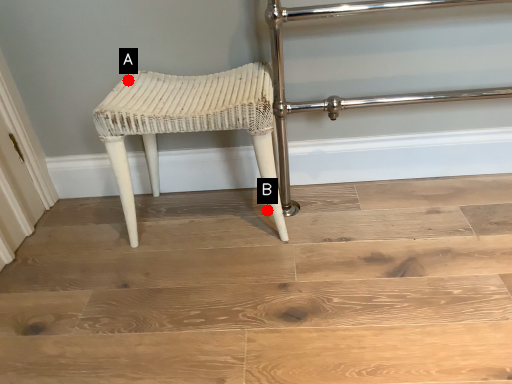
Question: Two points are circled on the image, labeled by A and B beside each circle. Which of the following is the closest to the observer?

Choices:
 (A) A is closer
 (B) B is closer

Answer: (A)